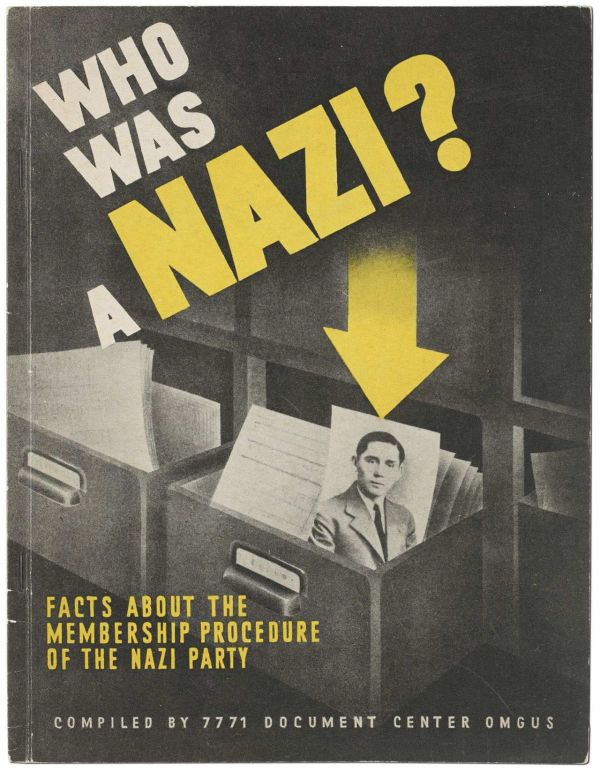
Where is `drawer handles`? Image resolution: width=600 pixels, height=772 pixels. drawer handles is located at coordinates (64, 496), (288, 604).